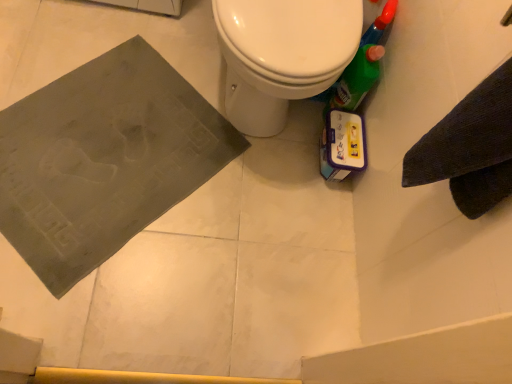
Where is `free spot in front of dark gray rubber mat at lower left`? The width and height of the screenshot is (512, 384). free spot in front of dark gray rubber mat at lower left is located at coordinates (89, 276).